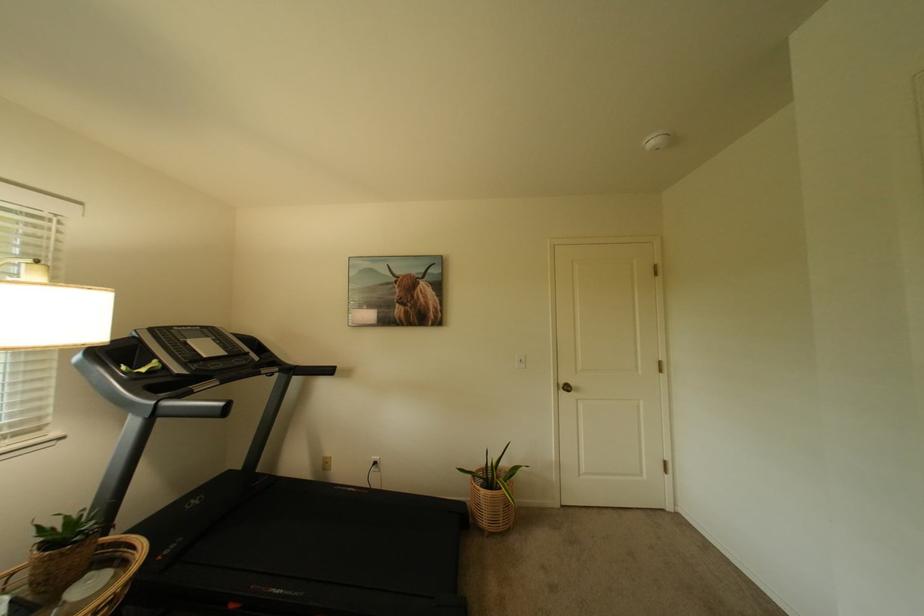
You are a GUI agent. You are given a task and a screenshot of the screen. Output one action in this format:
    pyautogui.click(x=<x>, y=<y>)
    Task: Click on the light switch
    The width and height of the screenshot is (924, 616).
    Given the screenshot: What is the action you would take?
    pyautogui.click(x=325, y=463)